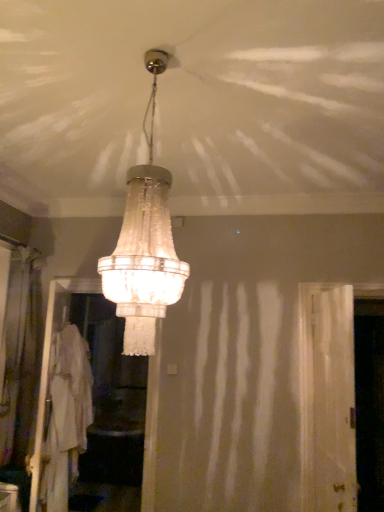
Question: From the image's perspective, does silky beige curtain at left appear higher than white translucent screen door at right, the 2th screen door viewed from the left?

Choices:
 (A) no
 (B) yes

Answer: (B)

Question: From the image's perspective, is silky beige curtain at left below white translucent screen door at right, the 2th screen door viewed from the left?

Choices:
 (A) no
 (B) yes

Answer: (A)

Question: From a real-world perspective, is silky beige curtain at left physically above white translucent screen door at right, the 2th screen door viewed from the left?

Choices:
 (A) no
 (B) yes

Answer: (B)

Question: Considering the relative sizes of silky beige curtain at left and white translucent screen door at right, the third screen door from the back, in the image provided, is silky beige curtain at left thinner than white translucent screen door at right, the third screen door from the back,?

Choices:
 (A) yes
 (B) no

Answer: (B)

Question: Is silky beige curtain at left outside white translucent screen door at right, the 2th screen door viewed from the left?

Choices:
 (A) no
 (B) yes

Answer: (B)

Question: Is clear glass chandelier at center inside or outside of white translucent screen door at right, the third screen door from the back?

Choices:
 (A) inside
 (B) outside

Answer: (B)

Question: Relative to white translucent screen door at right, which ranks as the second screen door in right-to-left order, is clear glass chandelier at center in front or behind?

Choices:
 (A) front
 (B) behind

Answer: (A)

Question: Does point (152, 248) appear closer or farther from the camera than point (307, 306)?

Choices:
 (A) closer
 (B) farther

Answer: (A)

Question: From the image's perspective, is clear glass chandelier at center above or below white translucent screen door at right, the third screen door from the back?

Choices:
 (A) above
 (B) below

Answer: (A)

Question: From a real-world perspective, is silky beige curtain at left above or below white cotton robe at lower left?

Choices:
 (A) above
 (B) below

Answer: (A)

Question: Is silky beige curtain at left inside the boundaries of white cotton robe at lower left, or outside?

Choices:
 (A) outside
 (B) inside

Answer: (A)

Question: Is silky beige curtain at left taller or shorter than white cotton robe at lower left?

Choices:
 (A) short
 (B) tall

Answer: (B)

Question: Is point (26, 430) closer or farther from the camera than point (43, 475)?

Choices:
 (A) closer
 (B) farther

Answer: (B)

Question: From the image's perspective, is silky beige curtain at left positioned above or below white translucent screen door at center, which ranks as the third screen door in right-to-left order?

Choices:
 (A) below
 (B) above

Answer: (B)

Question: Is silky beige curtain at left wider or thinner than white translucent screen door at center, which appears as the second screen door when viewed from the back?

Choices:
 (A) thin
 (B) wide

Answer: (B)